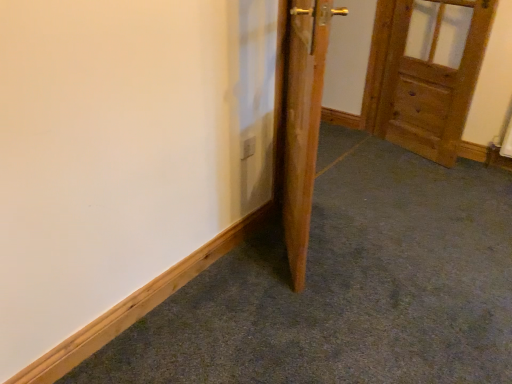
Question: From a real-world perspective, relative to wooden door at upper right, the 1th door viewed from the back, is wooden door at center, which is the second door from right to left, vertically above or below?

Choices:
 (A) below
 (B) above

Answer: (B)

Question: Considering the relative positions of wooden door at center, which is the 1th door in left-to-right order, and wooden door at upper right, acting as the second door starting from the front, in the image provided, is wooden door at center, which is the 1th door in left-to-right order, to the left or to the right of wooden door at upper right, acting as the second door starting from the front,?

Choices:
 (A) left
 (B) right

Answer: (A)

Question: In terms of size, does wooden door at center, which appears as the 1th door when viewed from the front, appear bigger or smaller than wooden door at upper right, the 1th door from the right?

Choices:
 (A) big
 (B) small

Answer: (A)

Question: Looking at the image, does wooden door at upper right, acting as the second door starting from the front, seem bigger or smaller compared to wooden door at center, which is the 1th door in left-to-right order?

Choices:
 (A) big
 (B) small

Answer: (B)

Question: Which is correct: wooden door at upper right, the 1th door from the right, is inside wooden door at center, which appears as the 1th door when viewed from the front, or outside of it?

Choices:
 (A) outside
 (B) inside

Answer: (A)

Question: From the image's perspective, is wooden door at upper right, which ranks as the 2th door in left-to-right order, above or below wooden door at center, which is the 1th door in left-to-right order?

Choices:
 (A) above
 (B) below

Answer: (A)

Question: In the image, is wooden door at upper right, acting as the second door starting from the front, positioned in front of or behind wooden door at center, acting as the 2th door starting from the back?

Choices:
 (A) front
 (B) behind

Answer: (B)